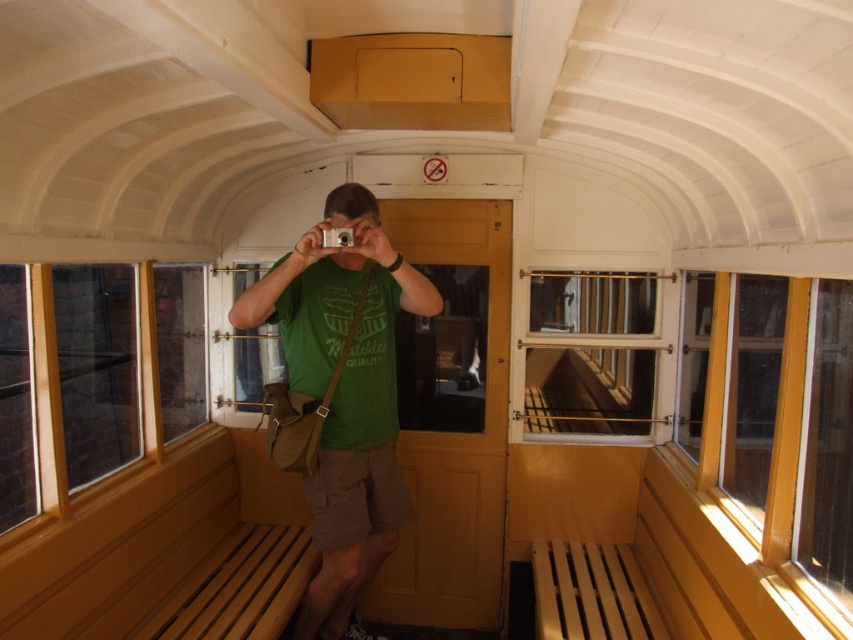
Is green fabric shirt at center to the right of wooden slats at center from the viewer's perspective?

Incorrect, green fabric shirt at center is not on the right side of wooden slats at center.

How much distance is there between green fabric shirt at center and wooden slats at center?

green fabric shirt at center is 4.06 feet away from wooden slats at center.

Which is behind, point (340, 259) or point (537, 412)?

The point (537, 412) is more distant.

Identify the location of green fabric shirt at center. The image size is (853, 640). (344, 394).